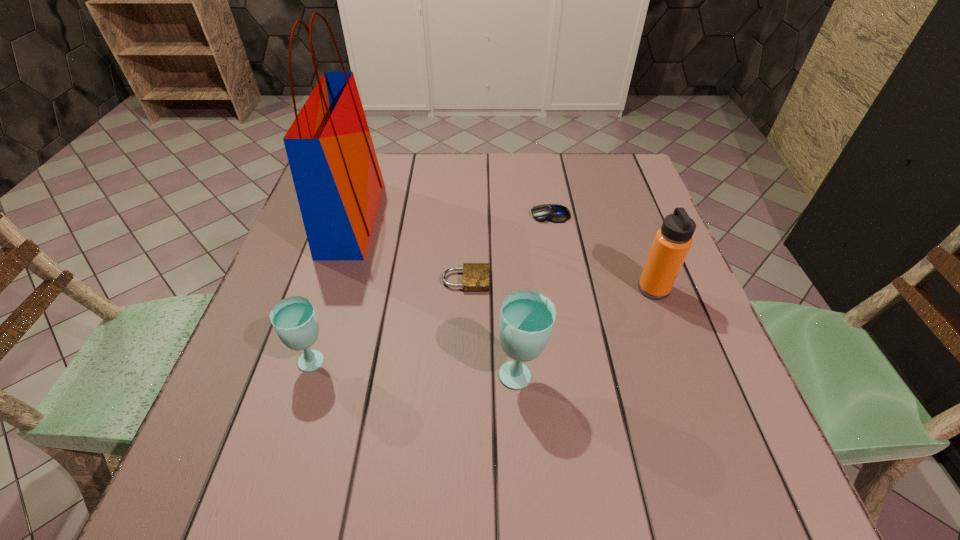
The height and width of the screenshot is (540, 960). In order to click on free area in between the taller glass and the shortest object in this screenshot , I will do `click(493, 327)`.

Where is `blank region between the computer mouse and the shopping bag`? Image resolution: width=960 pixels, height=540 pixels. blank region between the computer mouse and the shopping bag is located at coordinates (451, 217).

Find the location of a particular element. The width and height of the screenshot is (960, 540). free area in between the rightmost object and the fifth object from left to right is located at coordinates coord(602,252).

Find the location of a particular element. vacant space that is in between the tallest object and the padlock is located at coordinates (409, 249).

Identify the location of free space between the rightmost object and the computer mouse. This screenshot has height=540, width=960. (602, 252).

Locate an element on the screen. vacant region between the shopping bag and the fourth object from right to left is located at coordinates (409, 249).

Locate an element on the screen. This screenshot has width=960, height=540. vacant area that lies between the rightmost object and the right glass is located at coordinates (588, 332).

You are a GUI agent. You are given a task and a screenshot of the screen. Output one action in this format:
    pyautogui.click(x=<x>, y=<y>)
    Task: Click on the vacant area that lies between the tallest object and the third shortest object
    
    Given the screenshot: What is the action you would take?
    pyautogui.click(x=333, y=291)

The height and width of the screenshot is (540, 960). What are the coordinates of `object that is the third closest to the shopping bag` in the screenshot? It's located at (527, 317).

Identify which object is the second closest to the second shortest object. Please provide its 2D coordinates. Your answer should be formatted as a tuple, i.e. [(x, y)], where the tuple contains the x and y coordinates of a point satisfying the conditions above.

[(672, 242)]